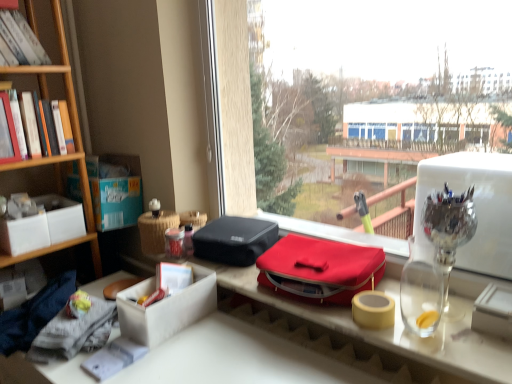
In order to click on free space to the left of yellow matte adhesive tape at right in this screenshot , I will do `click(324, 310)`.